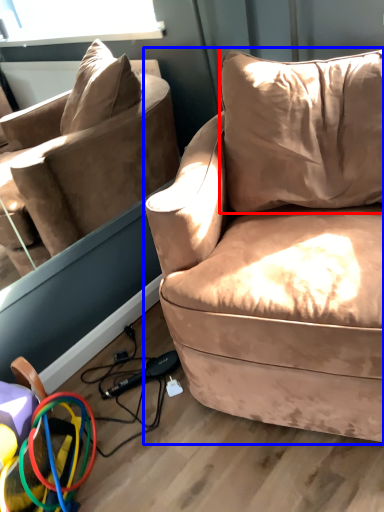
Question: Which object appears farthest to the camera in this image, pillow (highlighted by a red box) or studio couch (highlighted by a blue box)?

Choices:
 (A) pillow
 (B) studio couch

Answer: (A)